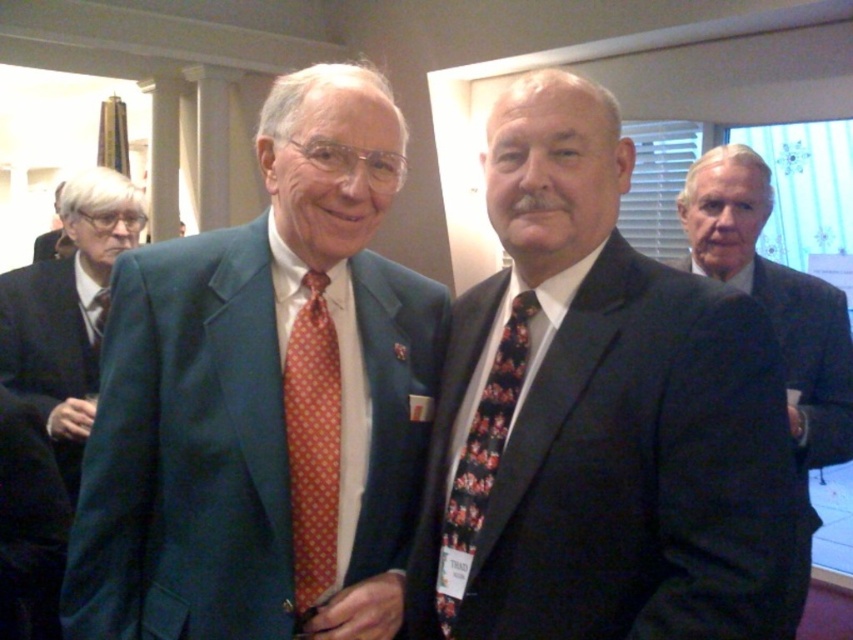
Does point (61, 310) lie in front of point (329, 323)?

No, (61, 310) is further to viewer.

Does matte black suit at left appear over orange dotted fabric tie at left?

Yes.

Between point (22, 371) and point (299, 579), which one is positioned in front?

Positioned in front is point (299, 579).

The width and height of the screenshot is (853, 640). I want to click on matte black suit at left, so click(67, 310).

Between matte black suit at left and matte black suit at upper left, which one has less height?

With less height is matte black suit at left.

Is matte black suit at left shorter than matte black suit at upper left?

Indeed, matte black suit at left has a lesser height compared to matte black suit at upper left.

Is point (59, 301) closer to viewer compared to point (68, 252)?

That is True.

Locate an element on the screen. matte black suit at left is located at coordinates (67, 310).

Which is more to the right, dark suit at center or black wool suit at right?

black wool suit at right

How much distance is there between dark suit at center and black wool suit at right?

40.91 centimeters

Find the location of `dark suit at center`. dark suit at center is located at coordinates (596, 417).